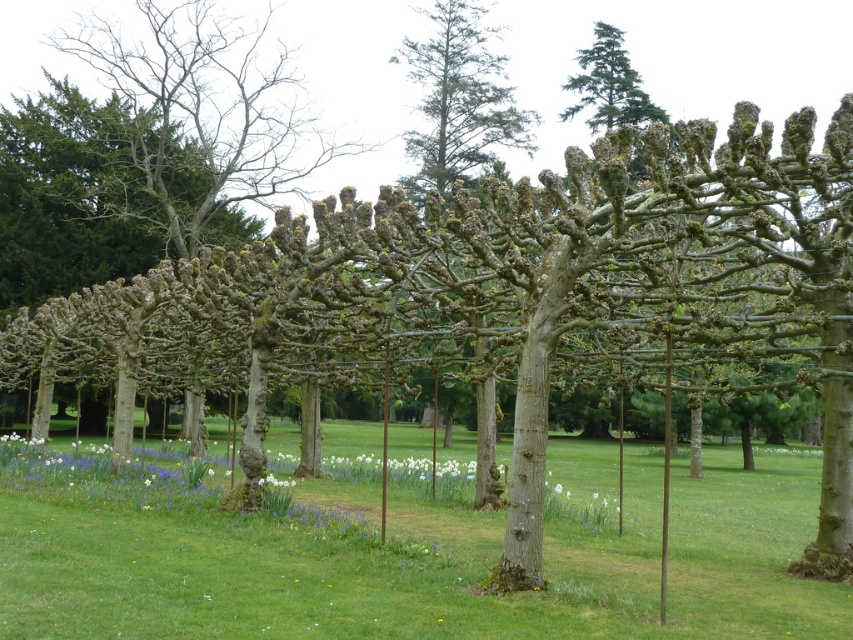
Question: Can you confirm if green grass at center is smaller than white matte flower at center?

Choices:
 (A) yes
 (B) no

Answer: (B)

Question: Among these points, which one is nearest to the camera?

Choices:
 (A) (656, 452)
 (B) (271, 474)

Answer: (B)

Question: Which point is farther from the camera taking this photo?

Choices:
 (A) (401, 572)
 (B) (276, 484)

Answer: (B)

Question: Considering the relative positions of green grass at center and white matte flower at center in the image provided, where is green grass at center located with respect to white matte flower at center?

Choices:
 (A) below
 (B) above

Answer: (A)

Question: Does green grass at center appear over white matte flower at center?

Choices:
 (A) yes
 (B) no

Answer: (B)